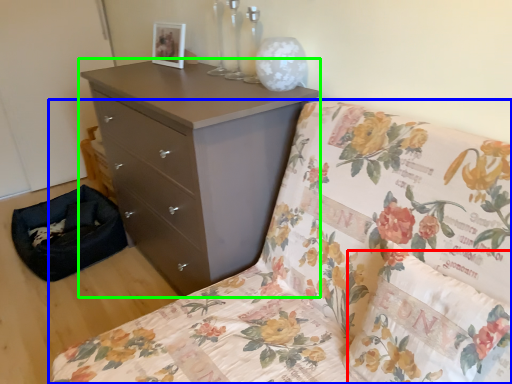
Question: Which object is the closest to the pillow (highlighted by a red box)? Choose among these: furniture (highlighted by a blue box) or chest of drawers (highlighted by a green box).

Choices:
 (A) furniture
 (B) chest of drawers

Answer: (A)